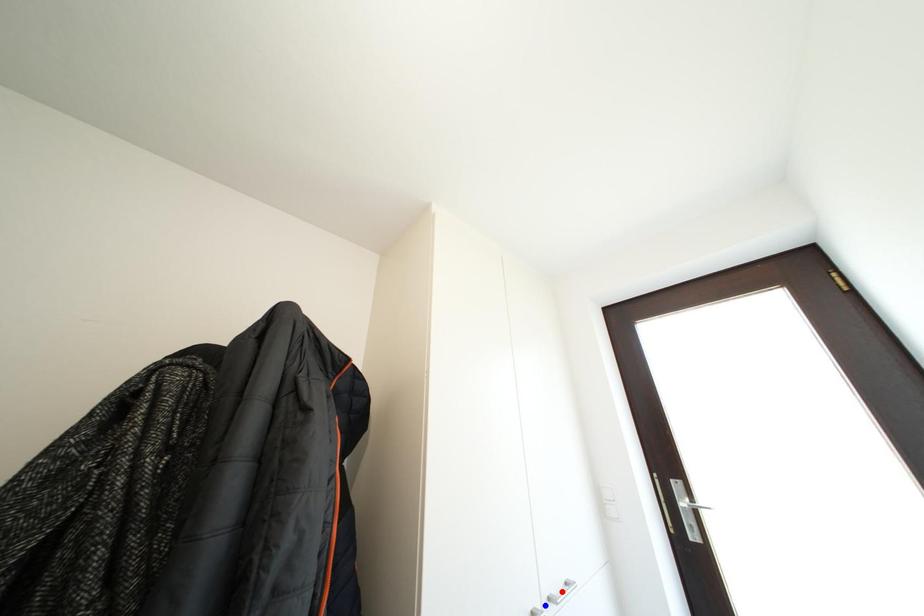
Question: In the image, two points are highlighted. Which point is nearer to the camera? Reply with the corresponding letter.

Choices:
 (A) blue point
 (B) red point

Answer: (A)